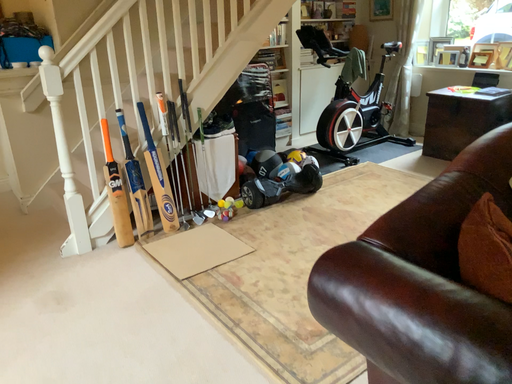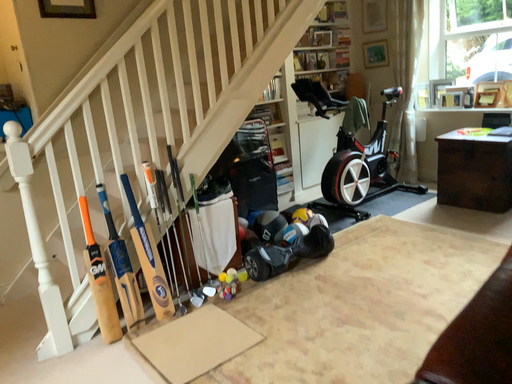
Question: How did the camera likely rotate when shooting the video?

Choices:
 (A) rotated downward
 (B) rotated upward

Answer: (B)